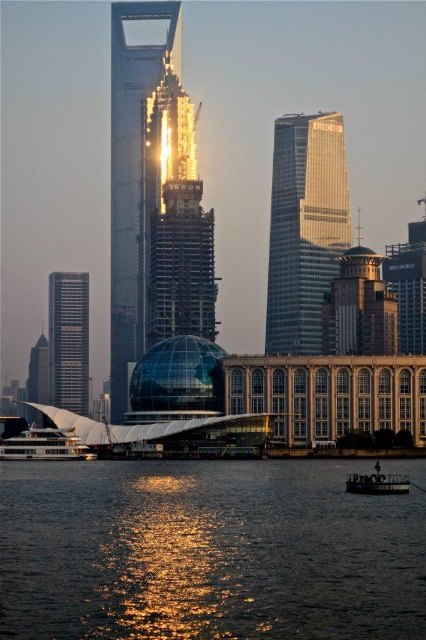
Is transparent glass dome at center shorter than metallic silver boat at lower center?

No.

Can you confirm if transparent glass dome at center is positioned below metallic silver boat at lower center?

Incorrect, transparent glass dome at center is not positioned below metallic silver boat at lower center.

The height and width of the screenshot is (640, 426). In order to click on transparent glass dome at center in this screenshot , I will do `click(141, 166)`.

Does point (331, 492) lie in front of point (138, 307)?

That is True.

Which is more to the left, glistening water at lower center or transparent glass dome at center?

transparent glass dome at center

This screenshot has height=640, width=426. Identify the location of glistening water at lower center. (207, 552).

Which of these two, glassy metallic skyscraper at center or white glossy boat at lower left, stands shorter?

white glossy boat at lower left

Is point (271, 211) positioned in front of point (16, 456)?

No, (271, 211) is further to viewer.

I want to click on glassy metallic skyscraper at center, so coord(305,227).